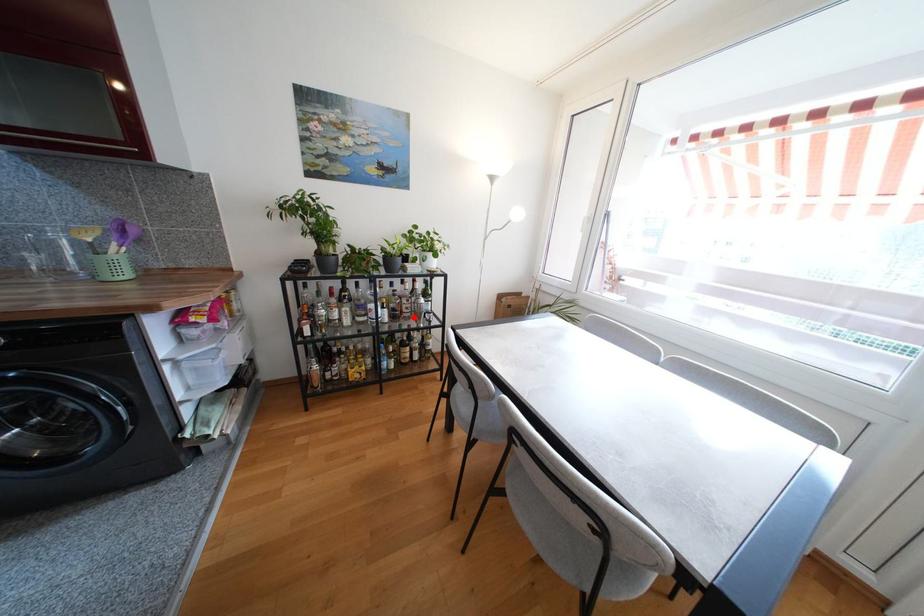
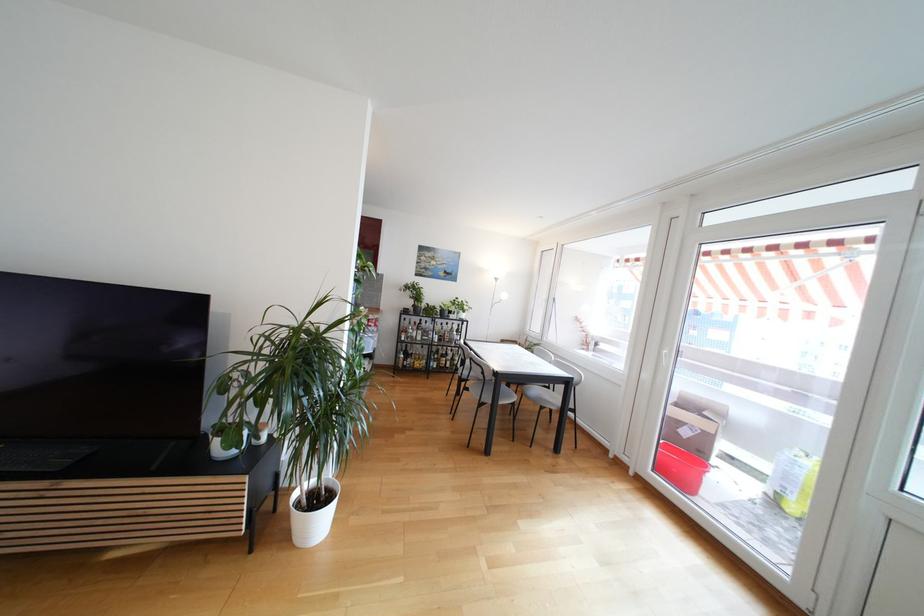
Question: I am providing you with two images of the same scene from different viewpoints. In image1, a red point is highlighted. Considering the same 3D point in image2, which of the following is correct?

Choices:
 (A) It is closer
 (B) It is farther

Answer: (B)